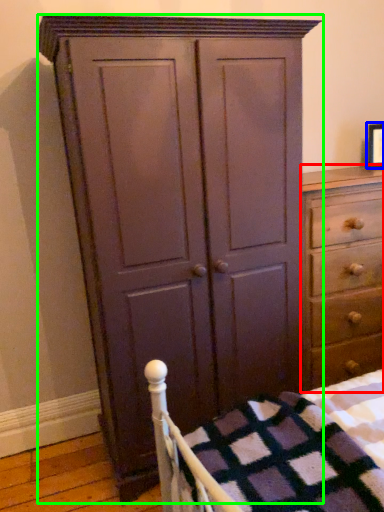
Question: Which object is the closest to the chest of drawers (highlighted by a red box)? Choose among these: picture frame (highlighted by a blue box) or cupboard (highlighted by a green box).

Choices:
 (A) picture frame
 (B) cupboard

Answer: (B)